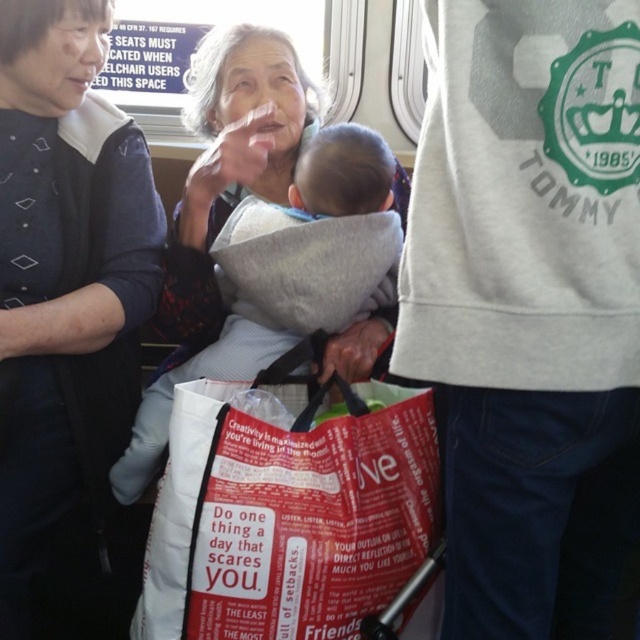
Which is below, gray fabric baby carrier at center or soft gray fabric baby carrier at center?

gray fabric baby carrier at center is below.

Who is higher up, gray fabric baby carrier at center or soft gray fabric baby carrier at center?

soft gray fabric baby carrier at center is higher up.

Is point (140, 196) farther from camera compared to point (237, 266)?

Yes.

Locate an element on the screen. The height and width of the screenshot is (640, 640). gray fabric baby carrier at center is located at coordinates (67, 317).

What do you see at coordinates (529, 305) in the screenshot? This screenshot has height=640, width=640. I see `white cotton sweatshirt at center` at bounding box center [529, 305].

Does white cotton sweatshirt at center appear under gray fabric baby carrier at center?

Actually, white cotton sweatshirt at center is above gray fabric baby carrier at center.

Measure the distance between white cotton sweatshirt at center and camera.

They are 26.67 inches apart.

Locate an element on the screen. white cotton sweatshirt at center is located at coordinates (529, 305).

Is gray fabric baby carrier at center shorter than red fabric bag at center?

In fact, gray fabric baby carrier at center may be taller than red fabric bag at center.

Which is below, gray fabric baby carrier at center or red fabric bag at center?

Positioned lower is red fabric bag at center.

What do you see at coordinates (67, 317) in the screenshot?
I see `gray fabric baby carrier at center` at bounding box center [67, 317].

Locate an element on the screen. gray fabric baby carrier at center is located at coordinates (67, 317).